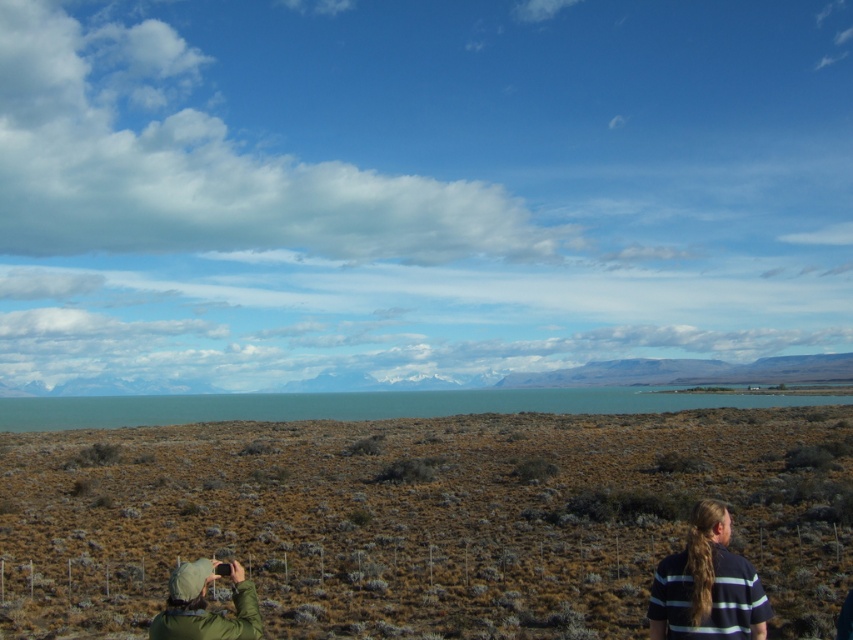
Between teal glossy water at center and dark blue striped shirt at lower right, which one has less height?

dark blue striped shirt at lower right

Does point (212, 404) lie in front of point (703, 580)?

No.

The image size is (853, 640). Identify the location of teal glossy water at center. (367, 404).

Find the location of a particular element. The width and height of the screenshot is (853, 640). teal glossy water at center is located at coordinates (367, 404).

Describe the element at coordinates (422, 518) in the screenshot. This screenshot has width=853, height=640. I see `brown dry grassland at center` at that location.

Which is behind, point (460, 477) or point (698, 522)?

Point (460, 477)

The image size is (853, 640). I want to click on brown dry grassland at center, so click(422, 518).

Is point (816, 627) less distant than point (225, 568)?

No, (816, 627) is further to viewer.

Is point (457, 589) less distant than point (155, 637)?

No, it is not.

Identify the location of brown dry grassland at center. (422, 518).